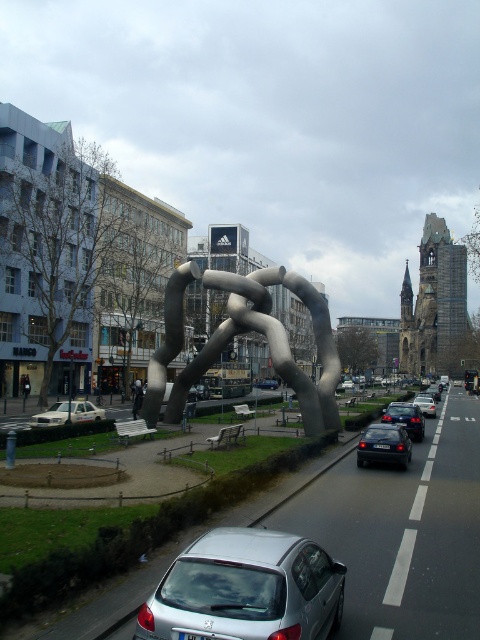
Question: Is polished silver sculpture at center positioned before black metallic car at center?

Choices:
 (A) no
 (B) yes

Answer: (A)

Question: Is black metallic car at center thinner than metallic silver car at center?

Choices:
 (A) no
 (B) yes

Answer: (B)

Question: Can you confirm if polished silver sculpture at center is positioned above shiny black sedan at center-right?

Choices:
 (A) yes
 (B) no

Answer: (A)

Question: Which of the following is the closest to the observer?

Choices:
 (A) (432, 406)
 (B) (35, 420)
 (C) (305, 426)

Answer: (C)

Question: Which of the following is the closest to the observer?

Choices:
 (A) (154, 401)
 (B) (421, 416)

Answer: (A)

Question: Which of the following is the farthest from the observer?

Choices:
 (A) (407, 428)
 (B) (85, 412)
 (C) (264, 378)
 (D) (277, 564)

Answer: (C)